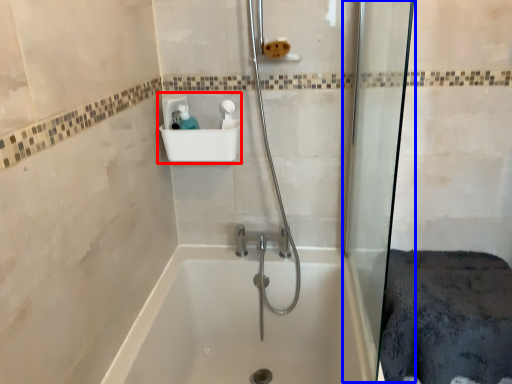
Question: Among these objects, which one is farthest to the camera, sink (highlighted by a red box) or shower door (highlighted by a blue box)?

Choices:
 (A) sink
 (B) shower door

Answer: (A)